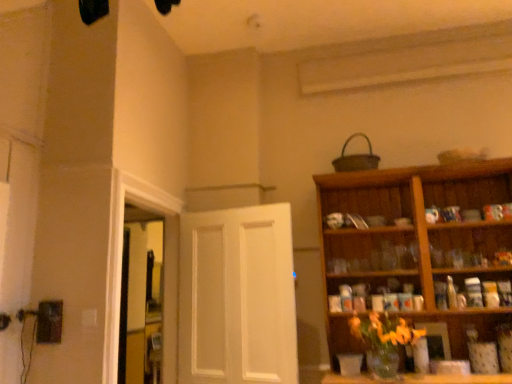
Question: From a real-world perspective, is wooden cabinet at upper right below transparent glass window at left?

Choices:
 (A) no
 (B) yes

Answer: (A)

Question: Can you confirm if wooden cabinet at upper right is thinner than transparent glass window at left?

Choices:
 (A) no
 (B) yes

Answer: (A)

Question: Considering the relative positions of wooden cabinet at upper right and transparent glass window at left in the image provided, is wooden cabinet at upper right to the left of transparent glass window at left from the viewer's perspective?

Choices:
 (A) no
 (B) yes

Answer: (A)

Question: Is wooden cabinet at upper right turned away from transparent glass window at left?

Choices:
 (A) no
 (B) yes

Answer: (A)

Question: Would you consider wooden cabinet at upper right to be distant from transparent glass window at left?

Choices:
 (A) yes
 (B) no

Answer: (A)

Question: From the image's perspective, is wooden cabinet at upper right located above transparent glass window at left?

Choices:
 (A) no
 (B) yes

Answer: (B)

Question: Is transparent glass window at left at the left side of wooden cabinet at upper right?

Choices:
 (A) no
 (B) yes

Answer: (B)

Question: Is transparent glass window at left further to camera compared to wooden cabinet at upper right?

Choices:
 (A) yes
 (B) no

Answer: (A)

Question: Can you confirm if transparent glass window at left is taller than wooden cabinet at upper right?

Choices:
 (A) no
 (B) yes

Answer: (A)

Question: Is transparent glass window at left not within wooden cabinet at upper right?

Choices:
 (A) no
 (B) yes

Answer: (B)

Question: Does transparent glass window at left have a larger size compared to wooden cabinet at upper right?

Choices:
 (A) no
 (B) yes

Answer: (A)

Question: From the image's perspective, is transparent glass window at left below wooden cabinet at upper right?

Choices:
 (A) yes
 (B) no

Answer: (A)

Question: Is white matte door at center looking in the opposite direction of transparent glass window at left?

Choices:
 (A) no
 (B) yes

Answer: (A)